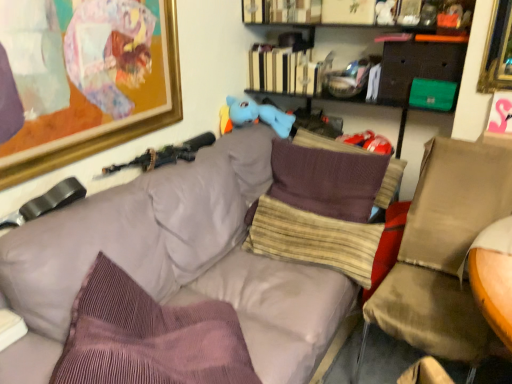
Question: Is blue plush toy at upper center outside of black plastic rifle at upper left?

Choices:
 (A) no
 (B) yes

Answer: (B)

Question: Does blue plush toy at upper center have a smaller size compared to black plastic rifle at upper left?

Choices:
 (A) yes
 (B) no

Answer: (B)

Question: Considering the relative positions of blue plush toy at upper center and black plastic rifle at upper left in the image provided, is blue plush toy at upper center in front of black plastic rifle at upper left?

Choices:
 (A) no
 (B) yes

Answer: (A)

Question: Is blue plush toy at upper center shorter than black plastic rifle at upper left?

Choices:
 (A) yes
 (B) no

Answer: (B)

Question: Is blue plush toy at upper center to the right of black plastic rifle at upper left from the viewer's perspective?

Choices:
 (A) yes
 (B) no

Answer: (A)

Question: From the image's perspective, is blue plush toy at upper center below black plastic rifle at upper left?

Choices:
 (A) yes
 (B) no

Answer: (B)

Question: Considering the relative sizes of hardcover book at upper center and striped fabric pillow at center, which ranks as the second pillow in front-to-back order, in the image provided, is hardcover book at upper center wider than striped fabric pillow at center, which ranks as the second pillow in front-to-back order,?

Choices:
 (A) yes
 (B) no

Answer: (B)

Question: Is hardcover book at upper center outside striped fabric pillow at center, the 2th pillow when ordered from back to front?

Choices:
 (A) yes
 (B) no

Answer: (A)

Question: Can you confirm if hardcover book at upper center is smaller than striped fabric pillow at center, the 2th pillow when ordered from back to front?

Choices:
 (A) no
 (B) yes

Answer: (B)

Question: Is hardcover book at upper center at the left side of striped fabric pillow at center, the 2th pillow when ordered from back to front?

Choices:
 (A) no
 (B) yes

Answer: (B)

Question: Is hardcover book at upper center thinner than striped fabric pillow at center, the 2th pillow when ordered from back to front?

Choices:
 (A) no
 (B) yes

Answer: (B)

Question: Is striped fabric pillow at center, which ranks as the second pillow in front-to-back order, inside hardcover book at upper center?

Choices:
 (A) no
 (B) yes

Answer: (A)

Question: From the image's perspective, is gold-framed artwork at upper left above striped fabric pillow at center, which ranks as the second pillow in front-to-back order?

Choices:
 (A) no
 (B) yes

Answer: (B)